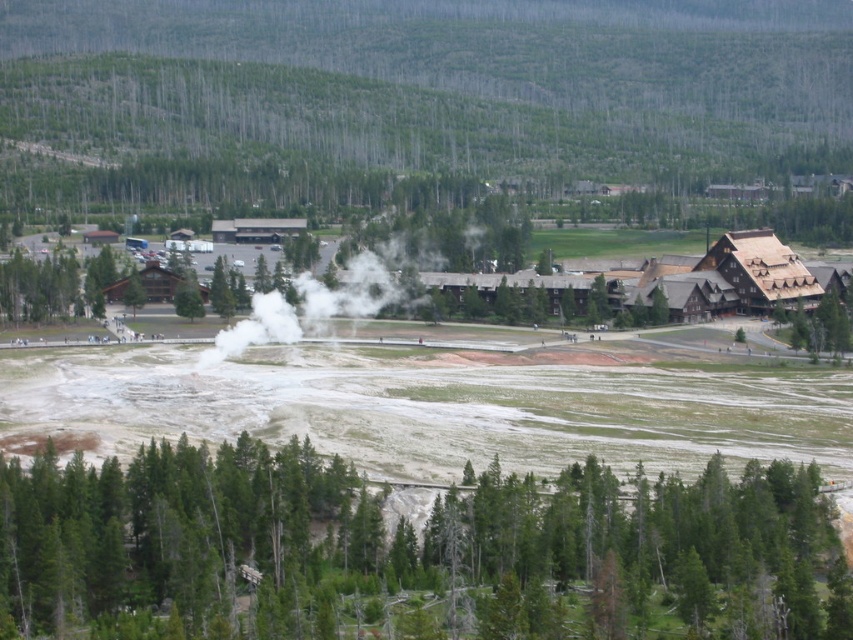
Does point (79, 550) lie in front of point (132, 282)?

That is True.

Looking at this image, who is shorter, green matte tree at lower left or green matte tree at center?

green matte tree at center

Is point (44, 493) closer to camera compared to point (134, 289)?

Yes, it is in front of point (134, 289).

This screenshot has width=853, height=640. In order to click on green matte tree at lower left in this screenshot , I will do `click(181, 540)`.

Is green matte tree at lower left taller than brown wooden building at right?

In fact, green matte tree at lower left may be shorter than brown wooden building at right.

Between point (264, 548) and point (809, 333), which one is positioned in front?

Point (264, 548) is more forward.

Locate an element on the screen. This screenshot has height=640, width=853. green matte tree at lower left is located at coordinates (181, 540).

Which is more to the right, white steam at center or brown wooden building at right?

From the viewer's perspective, brown wooden building at right appears more on the right side.

Is white steam at center bigger than brown wooden building at right?

Yes.

Which is behind, point (395, 294) or point (824, 339)?

Positioned behind is point (395, 294).

This screenshot has width=853, height=640. What are the coordinates of `white steam at center` in the screenshot? It's located at (306, 307).